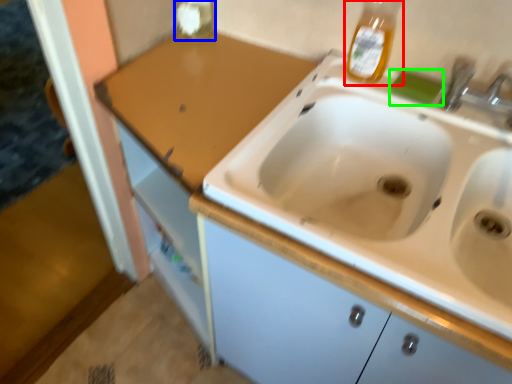
Question: Which object is positioned farthest from bottle (highlighted by a red box)? Select from bottle (highlighted by a blue box) and soap (highlighted by a green box).

Choices:
 (A) bottle
 (B) soap

Answer: (A)